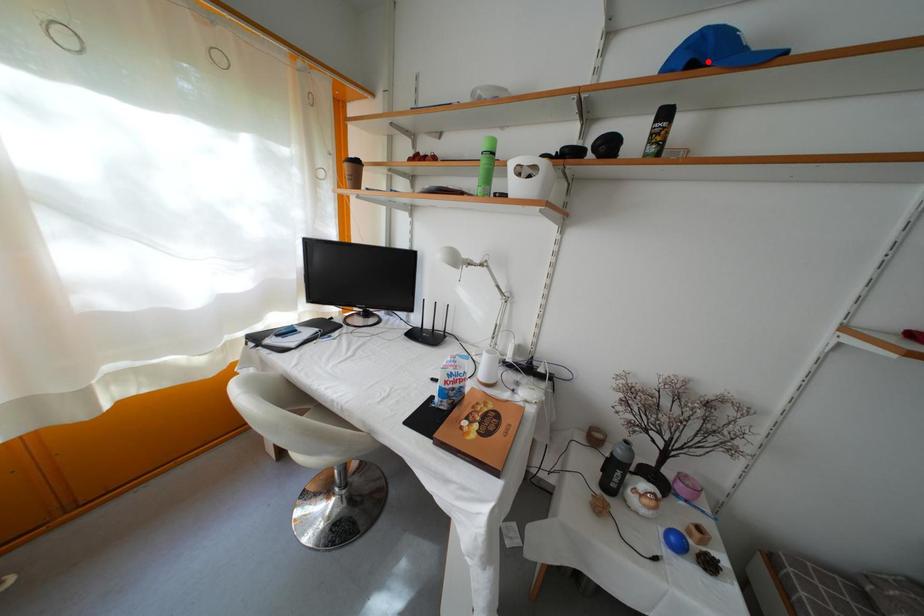
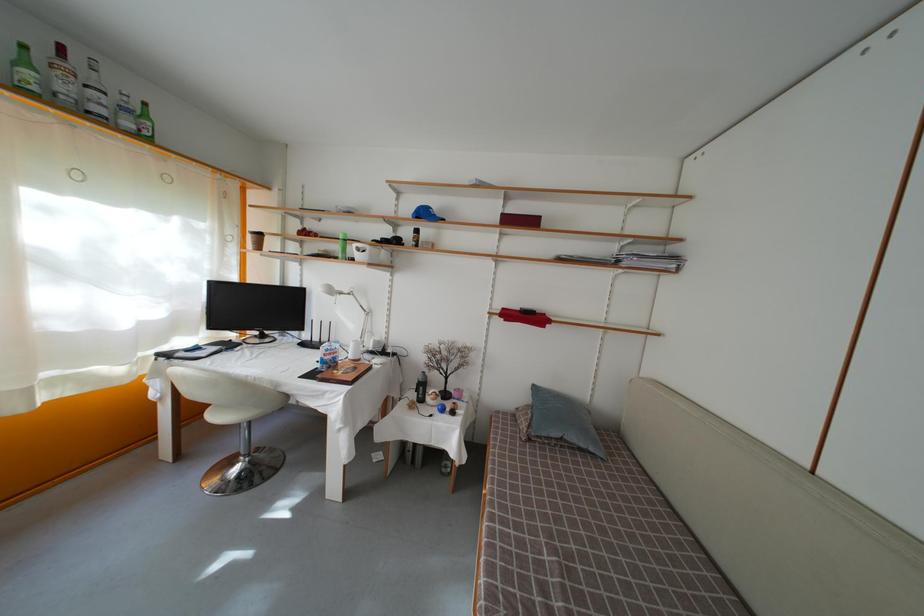
Question: I am providing you with two images of the same scene from different viewpoints. Image1 has a red point marked. In image2, the corresponding 3D location appears at what relative position? Reply with the corresponding letter.

Choices:
 (A) Closer
 (B) Farther

Answer: (A)